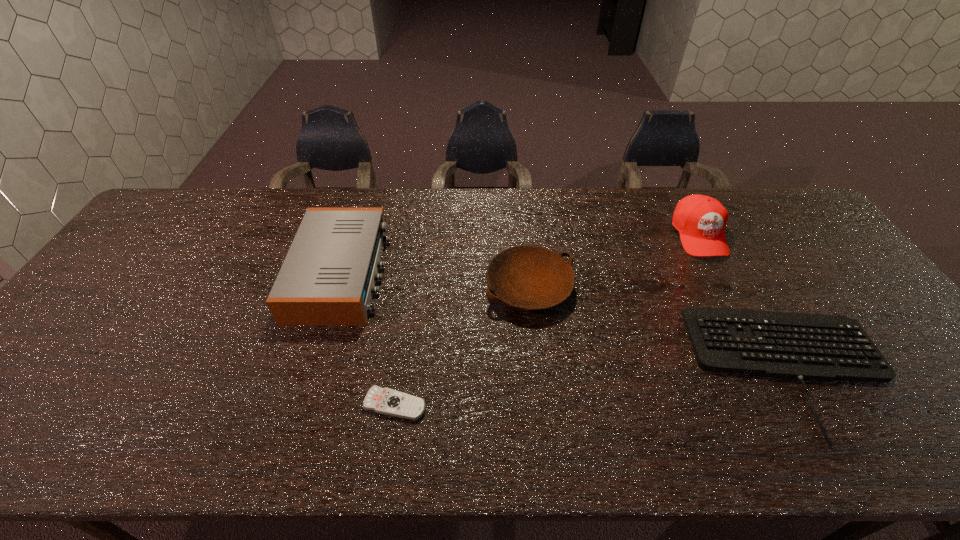
Identify the location of vacant space located on the right of the plate. The image size is (960, 540). (627, 287).

This screenshot has height=540, width=960. In order to click on free space located on the left of the fourth tallest object in this screenshot , I will do `click(579, 369)`.

What are the coordinates of `vacant space located on the back of the fourth object from right to left` in the screenshot? It's located at (410, 305).

You are a GUI agent. You are given a task and a screenshot of the screen. Output one action in this format:
    pyautogui.click(x=<x>, y=<y>)
    Task: Click on the baseball cap that is at the far edge
    Image resolution: width=960 pixels, height=540 pixels.
    Given the screenshot: What is the action you would take?
    pyautogui.click(x=701, y=220)

The width and height of the screenshot is (960, 540). What are the coordinates of `radio receiver that is at the far edge` in the screenshot? It's located at (328, 277).

Locate an element on the screen. computer keyboard that is positioned at the near edge is located at coordinates (818, 347).

Find the location of a particular element. remote control that is positioned at the near edge is located at coordinates (387, 401).

Where is `object situated at the right edge`? The image size is (960, 540). object situated at the right edge is located at coordinates (818, 347).

Identify the location of object that is at the near right corner. (818, 347).

Where is `vacant space at the far edge of the desktop`? The image size is (960, 540). vacant space at the far edge of the desktop is located at coordinates (591, 227).